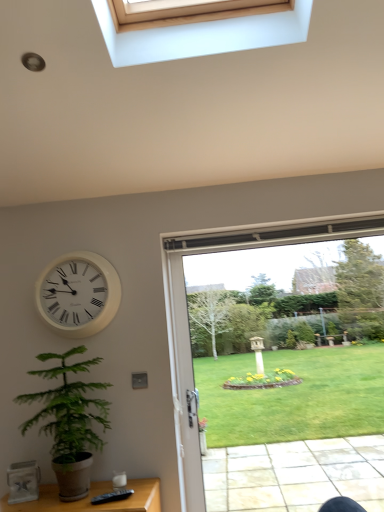
Question: Does green leafy plant at lower left appear on the right side of white plastic clock at upper left?

Choices:
 (A) yes
 (B) no

Answer: (A)

Question: Does green leafy plant at lower left have a greater width compared to white plastic clock at upper left?

Choices:
 (A) yes
 (B) no

Answer: (A)

Question: Is green leafy plant at lower left further to camera compared to white plastic clock at upper left?

Choices:
 (A) yes
 (B) no

Answer: (B)

Question: From a real-world perspective, is green leafy plant at lower left over white plastic clock at upper left?

Choices:
 (A) yes
 (B) no

Answer: (B)

Question: Is green leafy plant at lower left taller than white plastic clock at upper left?

Choices:
 (A) yes
 (B) no

Answer: (A)

Question: Considering the relative positions of clear glass door at center and white plastic clock at upper left in the image provided, is clear glass door at center to the left or to the right of white plastic clock at upper left?

Choices:
 (A) left
 (B) right

Answer: (B)

Question: Considering the positions of point (175, 302) and point (102, 278), is point (175, 302) closer or farther from the camera than point (102, 278)?

Choices:
 (A) farther
 (B) closer

Answer: (A)

Question: In terms of height, does clear glass door at center look taller or shorter compared to white plastic clock at upper left?

Choices:
 (A) short
 (B) tall

Answer: (B)

Question: Looking at the image, does clear glass door at center seem bigger or smaller compared to white plastic clock at upper left?

Choices:
 (A) small
 (B) big

Answer: (B)

Question: Is green leafy plant at lower left to the left or to the right of white plastic clock at upper left in the image?

Choices:
 (A) right
 (B) left

Answer: (A)

Question: Is green leafy plant at lower left wider or thinner than white plastic clock at upper left?

Choices:
 (A) thin
 (B) wide

Answer: (B)

Question: Is point (76, 490) closer or farther from the camera than point (57, 318)?

Choices:
 (A) closer
 (B) farther

Answer: (A)

Question: Looking at the image, does green leafy plant at lower left seem bigger or smaller compared to white plastic clock at upper left?

Choices:
 (A) small
 (B) big

Answer: (B)

Question: In terms of height, does clear glass door at center look taller or shorter compared to green leafy plant at lower left?

Choices:
 (A) short
 (B) tall

Answer: (B)

Question: Is clear glass door at center wider or thinner than green leafy plant at lower left?

Choices:
 (A) thin
 (B) wide

Answer: (A)